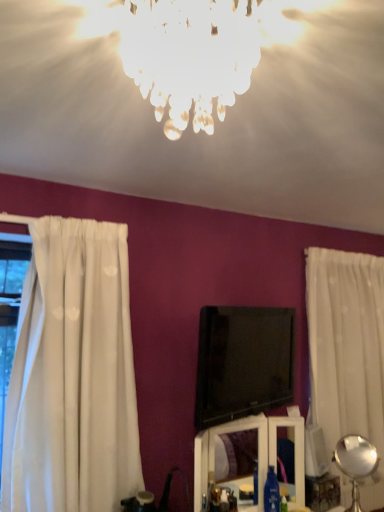
Question: Is white sheer curtain at right bigger or smaller than icy glass chandelier at upper center, which appears as the 1th lamp when viewed from the left?

Choices:
 (A) small
 (B) big

Answer: (B)

Question: Is point (377, 308) closer or farther from the camera than point (193, 9)?

Choices:
 (A) closer
 (B) farther

Answer: (B)

Question: Considering the real-world distances, which object is closest to the icy glass chandelier at upper center, the 2th lamp in the back-to-front sequence?

Choices:
 (A) metallic silver lamp at lower right, positioned as the first lamp in back-to-front order
 (B) black glossy tv at center
 (C) white sheer curtain at right
 (D) white glossy vanity at lower center

Answer: (B)

Question: Based on their relative distances, which object is farther from the white sheer curtain at right?

Choices:
 (A) metallic silver lamp at lower right, positioned as the first lamp in back-to-front order
 (B) white glossy vanity at lower center
 (C) icy glass chandelier at upper center, which appears as the 1th lamp when viewed from the top
 (D) black glossy tv at center

Answer: (C)